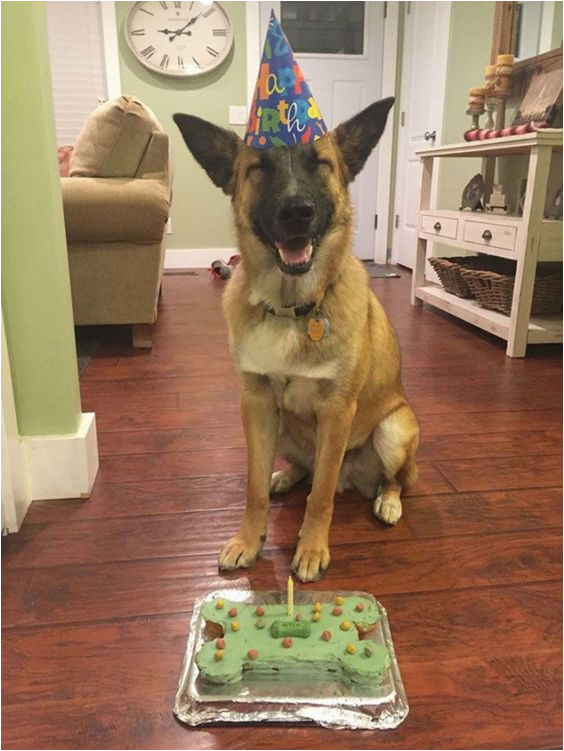
I want to click on couch, so click(x=153, y=270).